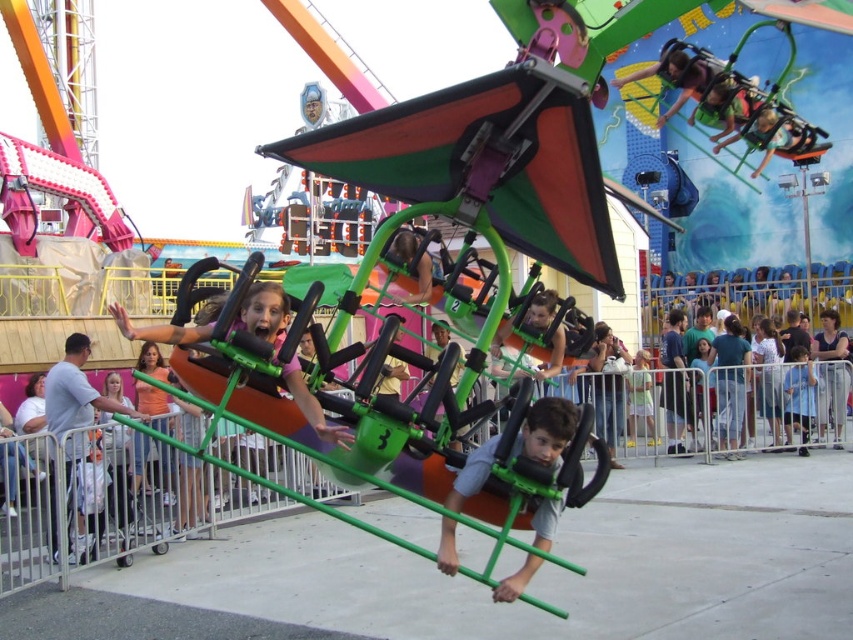
You are a photographer at the fairground. You want to capture a photo that includes both the gray fabric shirt at center and the blue fabric shirt at lower right. Based on their positions, which shirt should you focus on first to ensure both are in the frame?

The gray fabric shirt at center is below the blue fabric shirt at lower right, so you should focus on the blue fabric shirt at lower right first to ensure both are in the frame.

You are a photographer standing at the fairground. You want to take a photo of both the gray fabric shirt at center and the blue fabric shirt at lower right. Which shirt should you focus on first if you want to capture them both in the same frame without moving your camera?

You should focus on the gray fabric shirt at center first because it is taller than the blue fabric shirt at lower right, ensuring it fits within the frame when adjusting the camera angle.

You are standing at the point marked by coordinates point (483,477). You want to take a photo of the swinging chair ride with the vibrant mural in the background. Given that the camera is 109.97 feet away from your current position, will you be able to capture both the ride and the mural in the same frame?

The camera is 109.97 feet away from point (483,477), so yes, you can capture both the swinging chair ride and the vibrant mural in the same frame as they are within the camera range.